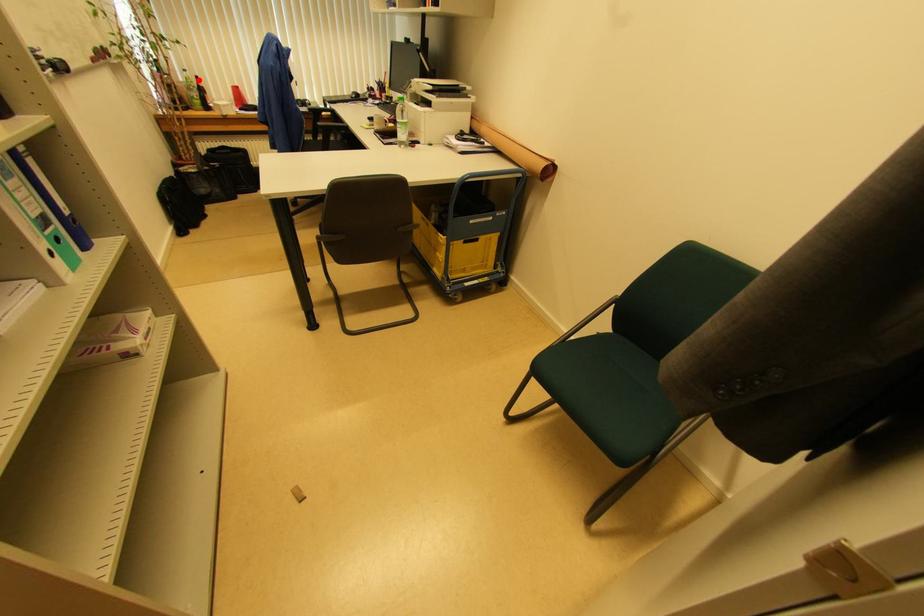
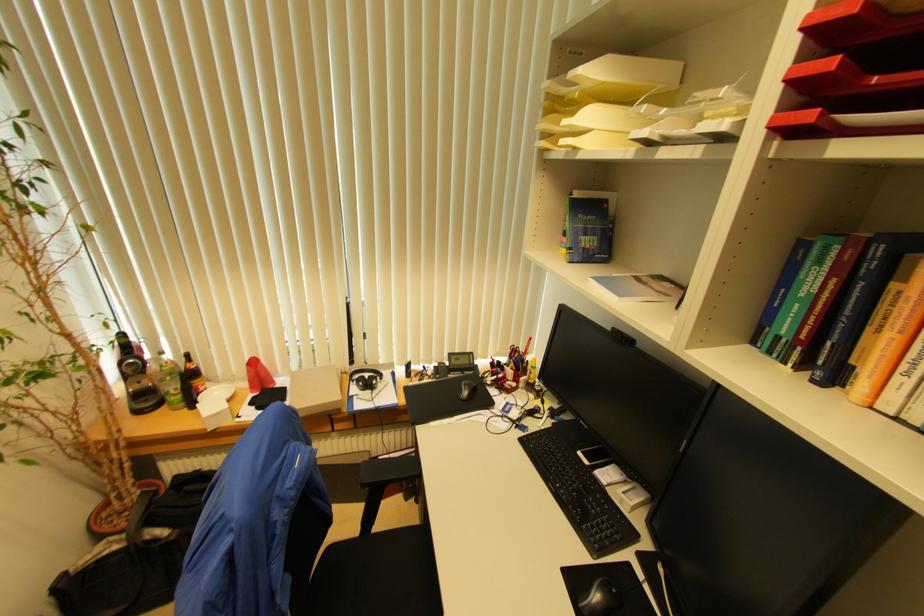
The point at the highlighted location is marked in the first image. Where is the corresponding point in the second image?

(188, 358)